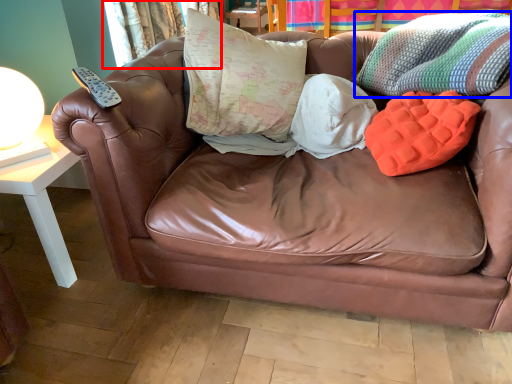
Question: Which of the following is the farthest to the observer, curtain (highlighted by a red box) or throw pillow (highlighted by a blue box)?

Choices:
 (A) curtain
 (B) throw pillow

Answer: (A)